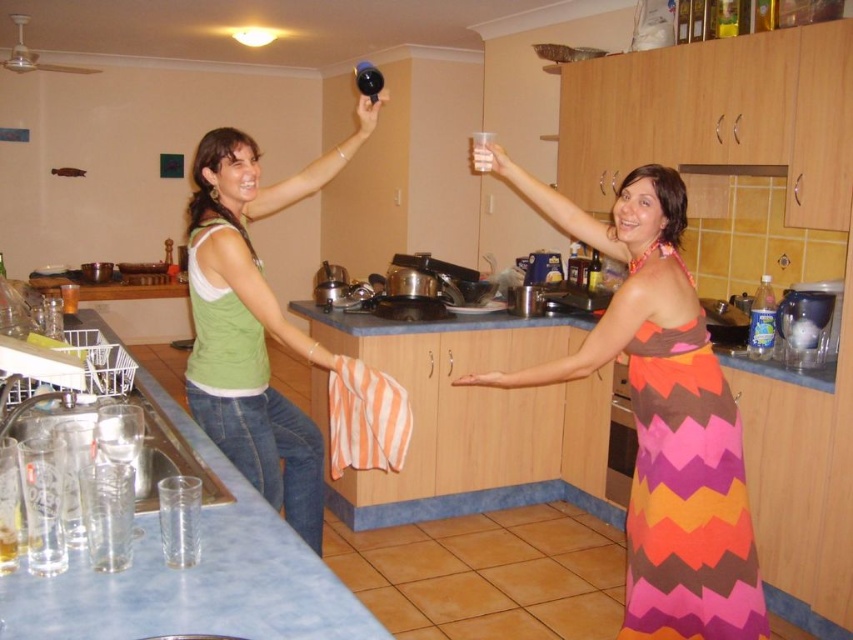
Question: Does matte plastic cup at upper center appear over matte black phone at upper center?

Choices:
 (A) yes
 (B) no

Answer: (B)

Question: Does matte plastic cup at upper center have a smaller size compared to pink fabric hand at center?

Choices:
 (A) yes
 (B) no

Answer: (B)

Question: Based on their relative distances, which object is farther from the pink fabric hand at center?

Choices:
 (A) green fabric tank top at upper left
 (B) matte black phone at upper center
 (C) matte plastic cup at upper center

Answer: (B)

Question: Estimate the real-world distances between objects in this image. Which object is closer to the matte plastic cup at upper center?

Choices:
 (A) matte black phone at upper center
 (B) green fabric tank top at upper left

Answer: (A)

Question: Is green fabric tank top at upper left positioned before pink fabric hand at center?

Choices:
 (A) no
 (B) yes

Answer: (B)

Question: Which object is closer to the camera taking this photo?

Choices:
 (A) matte plastic cup at upper center
 (B) green fabric tank top at upper left
 (C) multicolored woven dress at center
 (D) matte black phone at upper center

Answer: (B)